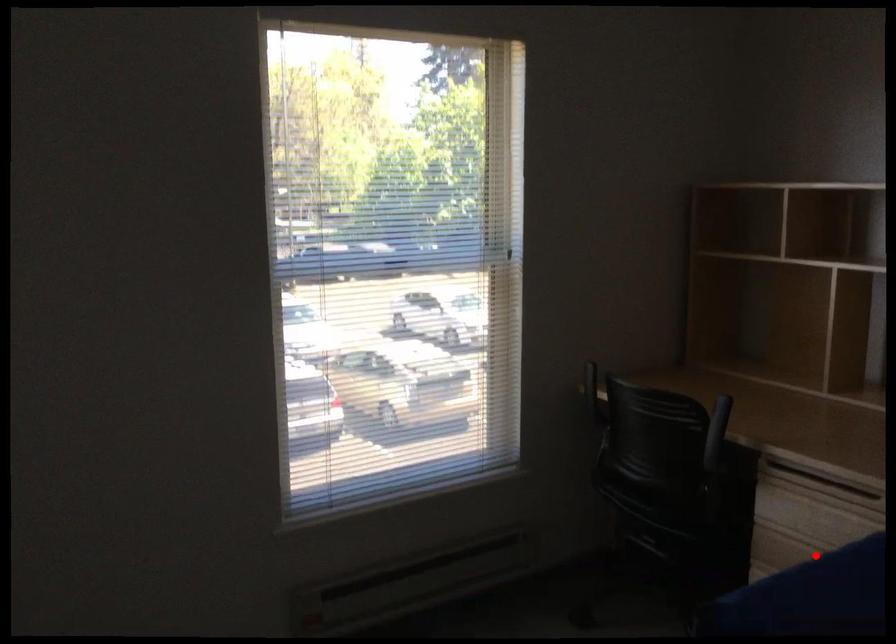
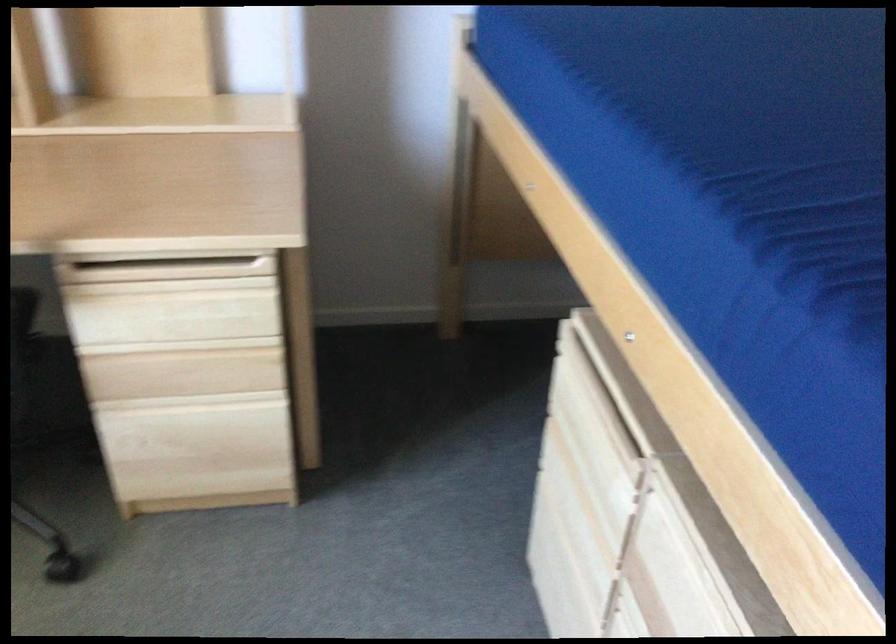
Question: A red point is marked in image1. In image2, is the corresponding 3D point closer to the camera or farther? Reply with the corresponding letter.

Choices:
 (A) The corresponding 3D point is closer.
 (B) The corresponding 3D point is farther.

Answer: (A)